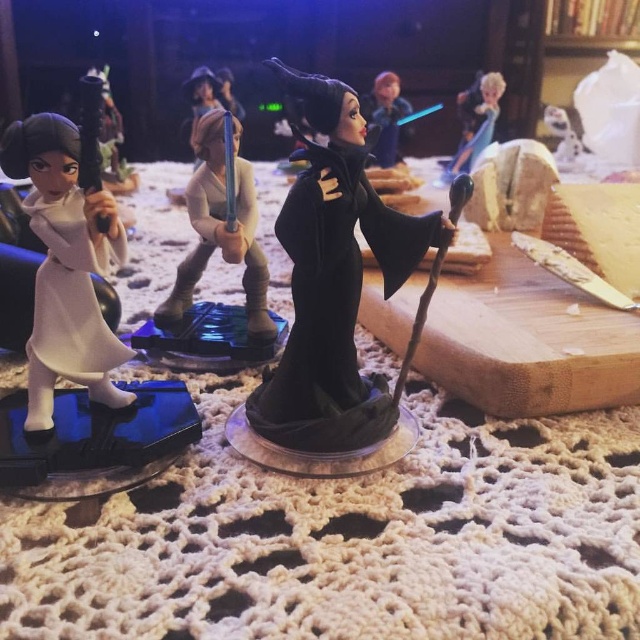
Question: Which of the following is the closest to the observer?

Choices:
 (A) (385, 224)
 (B) (186, 292)
 (C) (100, 337)

Answer: (C)

Question: Among these objects, which one is farthest from the camera?

Choices:
 (A) smooth plastic figure at upper center
 (B) black velvet figure at center

Answer: (A)

Question: Is black velvet figure at center further to camera compared to white glossy figure at left?

Choices:
 (A) yes
 (B) no

Answer: (A)

Question: Can you confirm if white glossy figure at left is positioned to the left of smooth plastic figure at upper center?

Choices:
 (A) no
 (B) yes

Answer: (B)

Question: Estimate the real-world distances between objects in this image. Which object is farther from the satin gold armor at center?

Choices:
 (A) black velvet figure at center
 (B) white glossy figure at left
 (C) smooth plastic figure at upper center

Answer: (C)

Question: Does black velvet figure at center come behind smooth plastic figure at upper center?

Choices:
 (A) yes
 (B) no

Answer: (B)